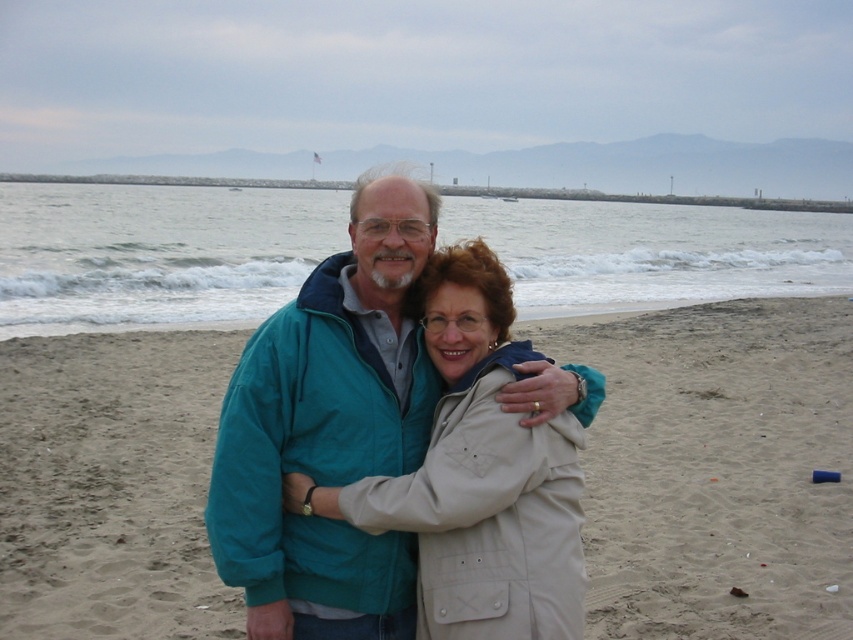
You are a photographer standing on the beach and want to take a photo of the clear water at center and the beige fabric jacket at center. Which object is closer to the camera?

The clear water at center is positioned over the beige fabric jacket at center, so the clear water at center is closer to the camera.

Looking at this image, you are a photographer on the beach and want to capture a photo where the beige sand at center and the beige fabric jacket at center are both visible. Which object should you adjust your camera angle to focus on first to ensure both are in frame?

The beige sand at center is positioned on the left side of the beige fabric jacket at center, so you should focus on the beige fabric jacket at center first to ensure both are included in the frame.